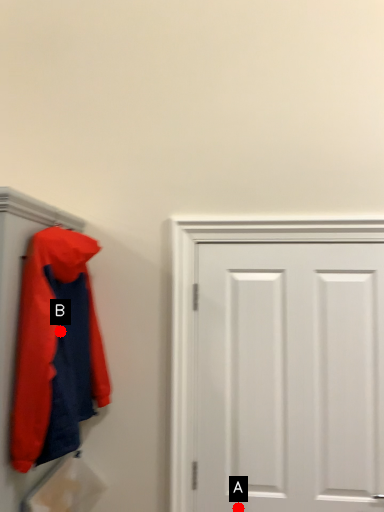
Question: Two points are circled on the image, labeled by A and B beside each circle. Which point is closer to the camera?

Choices:
 (A) A is closer
 (B) B is closer

Answer: (B)